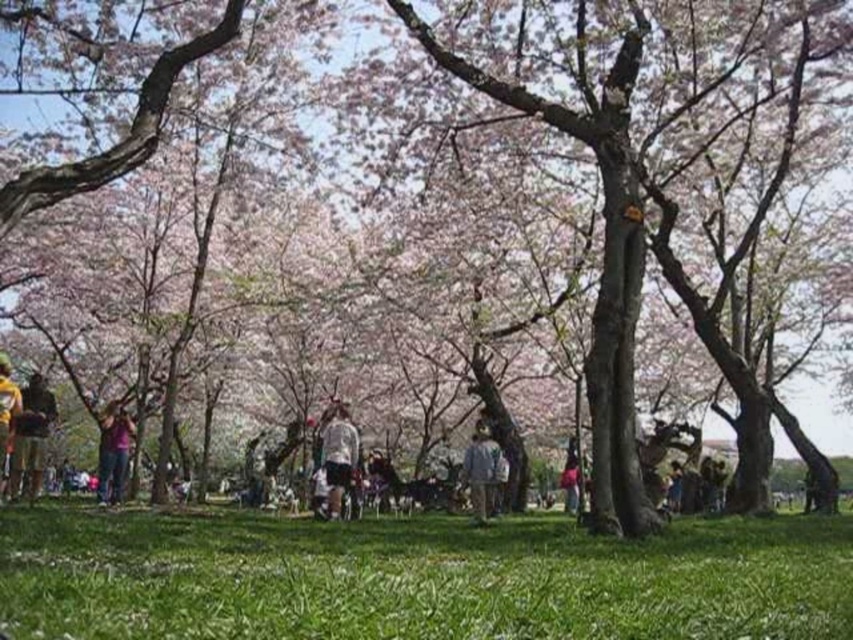
Does yellow fabric shirt at lower left come behind white matte shirt at center?

No, it is in front of white matte shirt at center.

Image resolution: width=853 pixels, height=640 pixels. Describe the element at coordinates (32, 435) in the screenshot. I see `yellow fabric shirt at lower left` at that location.

Where is `yellow fabric shirt at lower left`? yellow fabric shirt at lower left is located at coordinates (32, 435).

Can you confirm if yellow fabric shirt at lower left is bigger than yellow fabric bag at lower left?

No.

Who is positioned more to the right, yellow fabric shirt at lower left or yellow fabric bag at lower left?

From the viewer's perspective, yellow fabric shirt at lower left appears more on the right side.

Does point (9, 497) lie in front of point (6, 412)?

No.

Find the location of a particular element. The width and height of the screenshot is (853, 640). yellow fabric shirt at lower left is located at coordinates (32, 435).

Based on the photo, does green grass at lower center have a greater width compared to matte purple shirt at center?

Yes.

Is green grass at lower center to the right of matte purple shirt at center from the viewer's perspective?

Indeed, green grass at lower center is positioned on the right side of matte purple shirt at center.

The width and height of the screenshot is (853, 640). I want to click on green grass at lower center, so click(x=418, y=579).